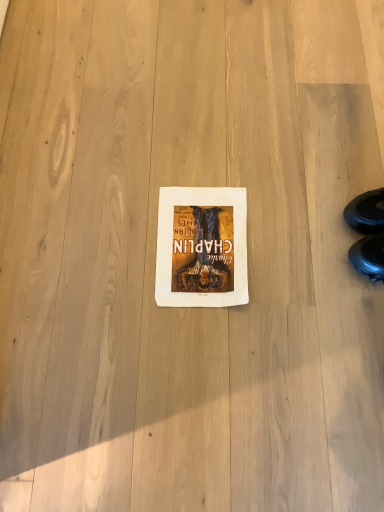
What do you see at coordinates (202, 247) in the screenshot?
I see `white paper at center` at bounding box center [202, 247].

Where is `white paper at center`? The image size is (384, 512). white paper at center is located at coordinates (202, 247).

Locate an element on the screen. The image size is (384, 512). black leather shoe at lower right is located at coordinates (367, 233).

What do you see at coordinates (367, 233) in the screenshot? The height and width of the screenshot is (512, 384). I see `black leather shoe at lower right` at bounding box center [367, 233].

Where is `white paper at center`? The width and height of the screenshot is (384, 512). white paper at center is located at coordinates (202, 247).

Between black leather shoe at lower right and white paper at center, which one appears on the right side from the viewer's perspective?

Positioned to the right is black leather shoe at lower right.

Does black leather shoe at lower right lie behind white paper at center?

No, it is in front of white paper at center.

Between point (383, 253) and point (235, 230), which one is positioned behind?

The point (235, 230) is more distant.

From the image's perspective, is black leather shoe at lower right above or below white paper at center?

From the image's perspective, black leather shoe at lower right appears below white paper at center.

Based on the photo, from a real-world perspective, is black leather shoe at lower right over white paper at center?

Yes, from a real-world perspective, black leather shoe at lower right is above white paper at center.

Between black leather shoe at lower right and white paper at center, which one has smaller width?

Thinner between the two is black leather shoe at lower right.

Considering the sizes of black leather shoe at lower right and white paper at center in the image, is black leather shoe at lower right taller or shorter than white paper at center?

In the image, black leather shoe at lower right appears to be taller than white paper at center.

Between black leather shoe at lower right and white paper at center, which one has larger size?

With larger size is black leather shoe at lower right.

Is black leather shoe at lower right inside the boundaries of white paper at center, or outside?

black leather shoe at lower right is located beyond the bounds of white paper at center.

Is black leather shoe at lower right directly adjacent to white paper at center?

black leather shoe at lower right is not next to white paper at center, and they're not touching.

Is black leather shoe at lower right facing towards white paper at center?

Yes, black leather shoe at lower right is turned towards white paper at center.

Can you tell me how much black leather shoe at lower right and white paper at center differ in facing direction?

The facing directions of black leather shoe at lower right and white paper at center are 89.7 degrees apart.

In the image, there is a black leather shoe at lower right. At what (x,y) coordinates should I click in order to perform the action: click on paperback book below it (from a real-world perspective). Please return your answer as a coordinate pair (x, y). The width and height of the screenshot is (384, 512). Looking at the image, I should click on (202, 247).

Considering the relative positions of white paper at center and black leather shoe at lower right in the image provided, is white paper at center to the left or to the right of black leather shoe at lower right?

white paper at center is to the left of black leather shoe at lower right.

Is the position of white paper at center more distant than that of black leather shoe at lower right?

Yes, the depth of white paper at center is greater than that of black leather shoe at lower right.

Considering the points (243, 298) and (378, 211), which point is in front, point (243, 298) or point (378, 211)?

The point (378, 211) is closer to the camera.

From the image's perspective, who appears lower, white paper at center or black leather shoe at lower right?

black leather shoe at lower right is shown below in the image.

From a real-world perspective, which is physically below, white paper at center or black leather shoe at lower right?

white paper at center.

Can you confirm if white paper at center is wider than black leather shoe at lower right?

Yes, white paper at center is wider than black leather shoe at lower right.

Between white paper at center and black leather shoe at lower right, which one has more height?

black leather shoe at lower right.

Does white paper at center have a larger size compared to black leather shoe at lower right?

Actually, white paper at center might be smaller than black leather shoe at lower right.

Would you say black leather shoe at lower right is part of white paper at center's contents?

No, black leather shoe at lower right is located outside of white paper at center.

Is white paper at center far away from black leather shoe at lower right?

white paper at center is actually quite close to black leather shoe at lower right.

Is black leather shoe at lower right at the back of white paper at center?

No, white paper at center is not facing away from black leather shoe at lower right.

How many degrees apart are the facing directions of white paper at center and black leather shoe at lower right?

The facing directions of white paper at center and black leather shoe at lower right are 89.7 degrees apart.

The width and height of the screenshot is (384, 512). In order to click on leather shoe on the right side of white paper at center in this screenshot , I will do `click(367, 233)`.

I want to click on leather shoe that appears in front of the white paper at center, so click(x=367, y=233).

Where is `leather shoe below the white paper at center (from the image's perspective)`? leather shoe below the white paper at center (from the image's perspective) is located at coordinates (367, 233).